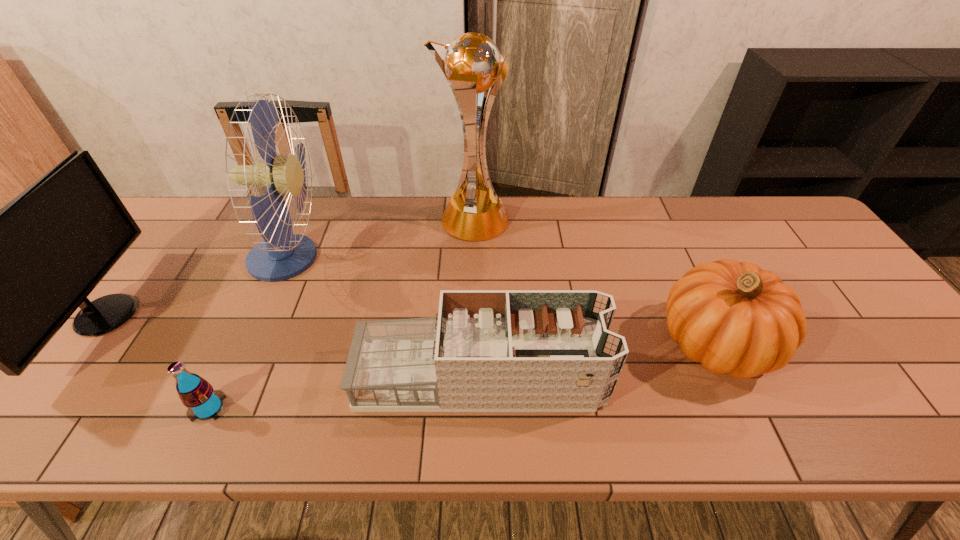
In the image, there is a desktop. At what (x,y) coordinates should I click in order to perform the action: click on vacant space at the near edge. Please return your answer as a coordinate pair (x, y). This screenshot has width=960, height=540. Looking at the image, I should click on (439, 413).

Where is `free location at the left edge`? This screenshot has width=960, height=540. free location at the left edge is located at coordinates (65, 388).

Identify the location of vacant space at the right edge of the desktop. (910, 392).

Identify the location of unoccupied area between the computer monitor and the soda. [158, 362].

At what (x,y) coordinates should I click in order to perform the action: click on free space between the fan and the fifth tallest object. Please return your answer as a coordinate pair (x, y). Looking at the image, I should click on (384, 319).

Where is `vacant space that's between the computer monitor and the dollhouse`? The height and width of the screenshot is (540, 960). vacant space that's between the computer monitor and the dollhouse is located at coordinates (294, 347).

I want to click on vacant point located between the trophy and the rightmost object, so click(x=594, y=282).

You are a GUI agent. You are given a task and a screenshot of the screen. Output one action in this format:
    pyautogui.click(x=<x>, y=<y>)
    Task: Click on the free space between the dollhouse and the third tallest object
    Image resolution: width=960 pixels, height=540 pixels.
    Given the screenshot: What is the action you would take?
    pyautogui.click(x=294, y=347)

Where is `empty space between the shortest object and the dollhouse`? empty space between the shortest object and the dollhouse is located at coordinates (345, 393).

Locate an element on the screen. This screenshot has width=960, height=540. the closest object to the soda is located at coordinates (282, 255).